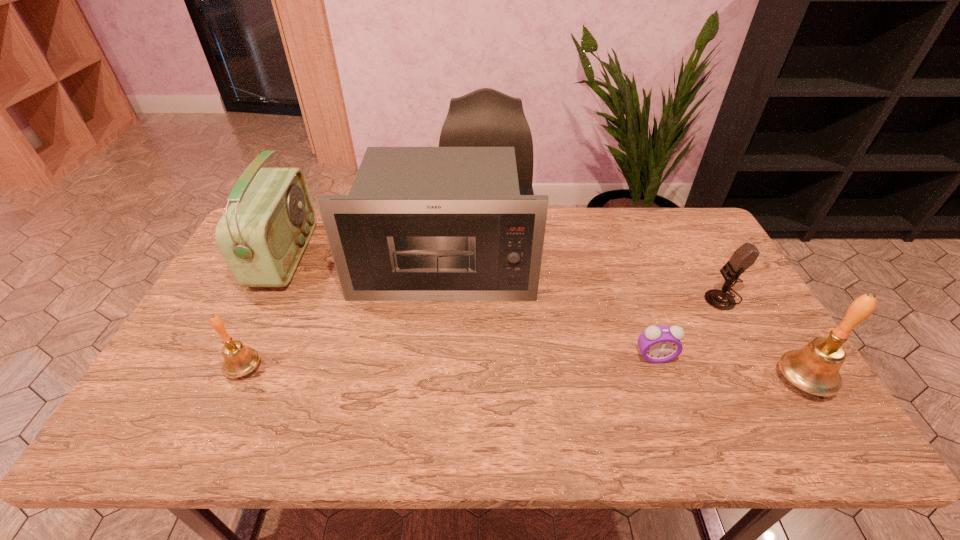
Identify the location of the shorter bell. The height and width of the screenshot is (540, 960). (238, 361).

I want to click on the right bell, so click(815, 368).

Find the location of a particular element. The height and width of the screenshot is (540, 960). the fourth object from right to left is located at coordinates (420, 223).

Where is `radio receiver`? The width and height of the screenshot is (960, 540). radio receiver is located at coordinates pyautogui.click(x=262, y=235).

At what (x,y) coordinates should I click in order to perform the action: click on the third object from right to left. Please return your answer as a coordinate pair (x, y). This screenshot has height=540, width=960. Looking at the image, I should click on (658, 344).

You are a GUI agent. You are given a task and a screenshot of the screen. Output one action in this format:
    pyautogui.click(x=<x>, y=<y>)
    Task: Click on the shortest object
    The height and width of the screenshot is (540, 960).
    Given the screenshot: What is the action you would take?
    pyautogui.click(x=658, y=344)

Find the location of a particular element. The image size is (960, 540). microphone is located at coordinates (745, 256).

Where is `vacant space situated on the right of the left bell`? The height and width of the screenshot is (540, 960). vacant space situated on the right of the left bell is located at coordinates (372, 368).

Find the location of a particular element. free region located on the back of the right bell is located at coordinates [750, 295].

This screenshot has width=960, height=540. I want to click on blank space located on the front-facing side of the microwave oven, so pyautogui.click(x=438, y=341).